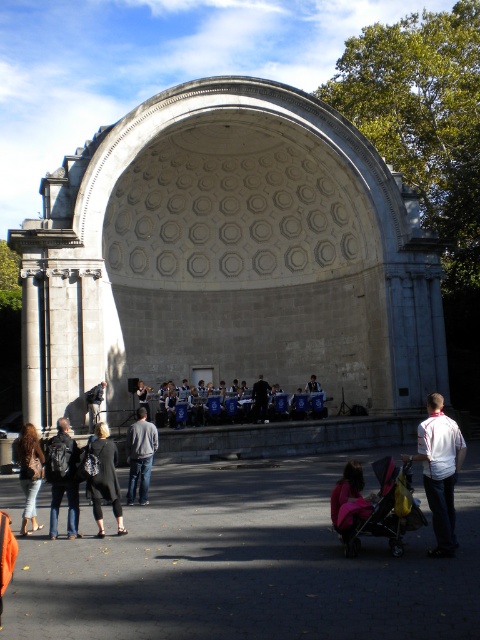
Is black leather jacket at center further to the viewer compared to dark gray stone statue at center?

No, it is in front of dark gray stone statue at center.

Can you confirm if black leather jacket at center is smaller than dark gray stone statue at center?

Actually, black leather jacket at center might be larger than dark gray stone statue at center.

Does point (94, 444) come closer to viewer compared to point (91, 419)?

Yes, it is in front of point (91, 419).

Locate an element on the screen. The image size is (480, 640). black leather jacket at center is located at coordinates (105, 477).

Between pink fabric stroller at lower center and black fabric at center, which one has more height?

pink fabric stroller at lower center is taller.

Consider the image. Is pink fabric stroller at lower center taller than black fabric at center?

Yes.

Identify the location of pink fabric stroller at lower center. (349, 499).

Find the location of a particular element. pink fabric stroller at lower center is located at coordinates (349, 499).

Which is above, black leather jacket at center or brown leather jacket at lower left?

black leather jacket at center is higher up.

Is point (99, 486) in front of point (40, 472)?

Yes, it is.

You are a GUI agent. You are given a task and a screenshot of the screen. Output one action in this format:
    pyautogui.click(x=<x>, y=<y>)
    Task: Click on the black leather jacket at center
    The height and width of the screenshot is (640, 480).
    Given the screenshot: What is the action you would take?
    pyautogui.click(x=105, y=477)